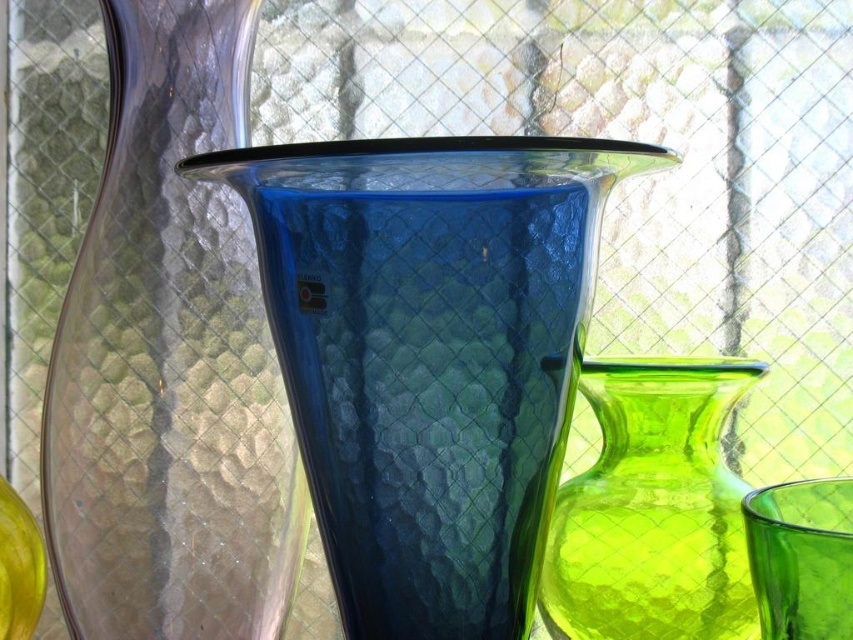
You are arranging flowers for a garden party and need to choose between the blue textured glass pitcher at center and the lime green glass vase at right. Which one is positioned closer to you, making it easier to reach?

The blue textured glass pitcher at center is closer to the viewer than the lime green glass vase at right, so it is easier to reach.

You are setting up a table for a party and need to place both the blue textured glass pitcher at center and the lime green glass vase at right. Given their sizes, which one should you place first to ensure stability?

The blue textured glass pitcher at center is wider than the lime green glass vase at right, so you should place the blue textured glass pitcher at center first to ensure stability as wider items provide a more stable base.

You are arranging these vases on a shelf that can only accommodate items where the transparent glass vase at left is wider than the lime green glass vase at right. Does the current arrangement meet this requirement?

Yes, the transparent glass vase at left is wider than the lime green glass vase at right, so the current arrangement meets the requirement.